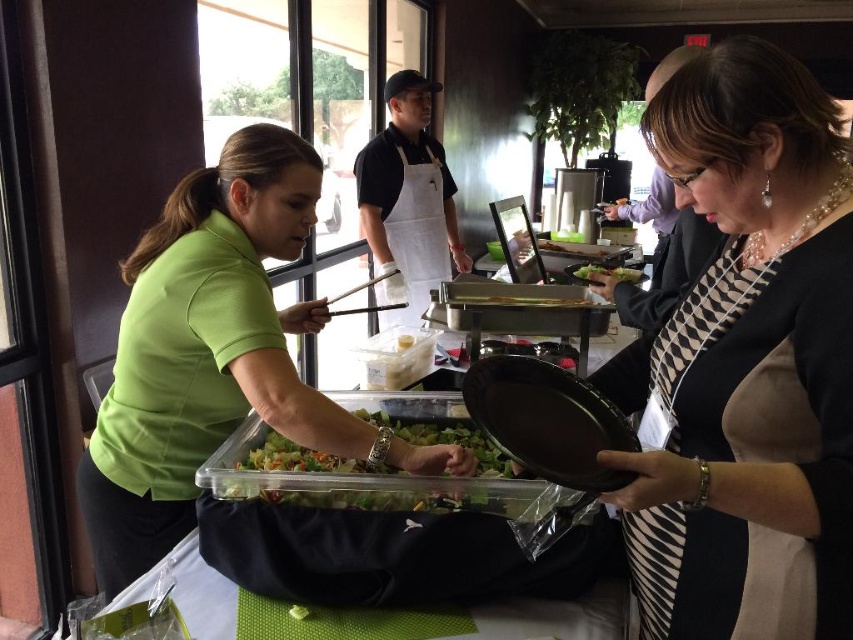
Question: Which point appears farthest from the camera in this image?

Choices:
 (A) (395, 221)
 (B) (624, 276)
 (C) (355, 502)

Answer: (A)

Question: Is black and white striped dress at center to the left of translucent plastic salad at center from the viewer's perspective?

Choices:
 (A) yes
 (B) no

Answer: (B)

Question: Is green matte shirt at center smaller than green leafy salad at center?

Choices:
 (A) yes
 (B) no

Answer: (B)

Question: Which of these objects is positioned closest to the green leafy salad at center?

Choices:
 (A) translucent plastic salad at center
 (B) black and white striped dress at center

Answer: (A)

Question: Which object is closer to the camera taking this photo?

Choices:
 (A) translucent plastic salad at center
 (B) white cotton apron at center

Answer: (A)

Question: In this image, where is black and white striped dress at center located relative to green leafy salad at center?

Choices:
 (A) right
 (B) left

Answer: (B)